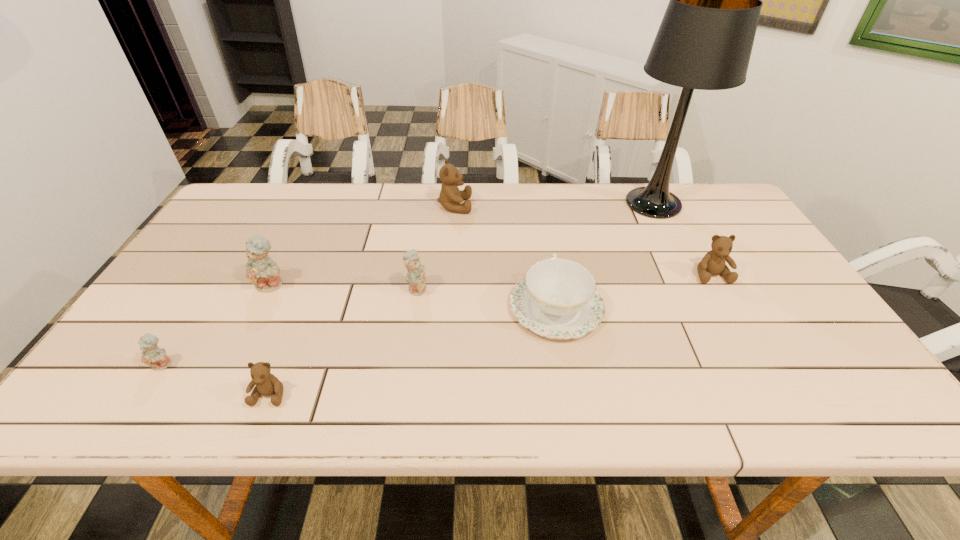
Identify which blue teddy bear is the second closest to the chinaware. Please provide its 2D coordinates. Your answer should be formatted as a tuple, i.e. [(x, y)], where the tuple contains the x and y coordinates of a point satisfying the conditions above.

[(262, 271)]

Identify which blue teddy bear is the second closest to the leftmost brown teddy bear. Please provide its 2D coordinates. Your answer should be formatted as a tuple, i.e. [(x, y)], where the tuple contains the x and y coordinates of a point satisfying the conditions above.

[(262, 271)]

Where is `vacant space that satisfies the following two spatial constraints: 1. on the front-facing side of the biggest brown teddy bear; 2. on the front-facing side of the second blue teddy bear from right to left`? vacant space that satisfies the following two spatial constraints: 1. on the front-facing side of the biggest brown teddy bear; 2. on the front-facing side of the second blue teddy bear from right to left is located at coordinates (449, 285).

You are a GUI agent. You are given a task and a screenshot of the screen. Output one action in this format:
    pyautogui.click(x=<x>, y=<y>)
    Task: Click on the free location that satisfies the following two spatial constraints: 1. on the front-facing side of the rightmost blue teddy bear; 2. on the front-facing side of the second nearest object
    
    Given the screenshot: What is the action you would take?
    pyautogui.click(x=406, y=364)

The image size is (960, 540). In order to click on free spot that satisfies the following two spatial constraints: 1. on the handle side of the sixth object from left to right; 2. on the front-facing side of the second smallest blue teddy bear in this screenshot , I will do `click(553, 288)`.

The width and height of the screenshot is (960, 540). In order to click on free location that satisfies the following two spatial constraints: 1. on the front-facing side of the farthest brown teddy bear; 2. on the handle side of the chinaware in this screenshot , I will do `click(447, 307)`.

Locate an element on the screen. The width and height of the screenshot is (960, 540). free space that satisfies the following two spatial constraints: 1. on the front-facing side of the farthest brown teddy bear; 2. on the handle side of the blue chinaware is located at coordinates (447, 307).